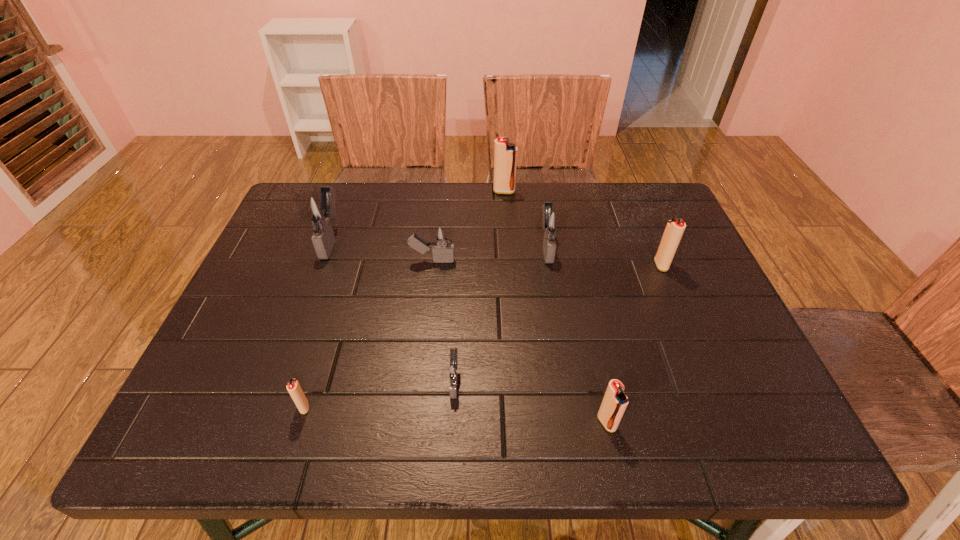
Identify the location of vacant space situated on the right of the smallest red igniter. (393, 407).

The image size is (960, 540). I want to click on free location located 0.170m on the back of the smallest gray igniter, so click(x=458, y=302).

I want to click on object that is at the left edge, so click(319, 210).

Locate an element on the screen. object that is at the right edge is located at coordinates (674, 230).

Find the location of a particular element. This screenshot has width=960, height=540. object present at the far left corner is located at coordinates (319, 210).

This screenshot has width=960, height=540. What are the coordinates of `vacant space at the far edge` in the screenshot? It's located at (401, 226).

This screenshot has height=540, width=960. Identify the location of free space at the near edge of the desktop. click(x=396, y=416).

What are the coordinates of `free space at the left edge` in the screenshot? It's located at (241, 316).

In the image, there is a desktop. Where is `blank space at the right edge`? This screenshot has height=540, width=960. blank space at the right edge is located at coordinates pos(693,273).

This screenshot has width=960, height=540. In the image, there is a desktop. Find the location of `vacant area at the far left corner`. vacant area at the far left corner is located at coordinates (276, 232).